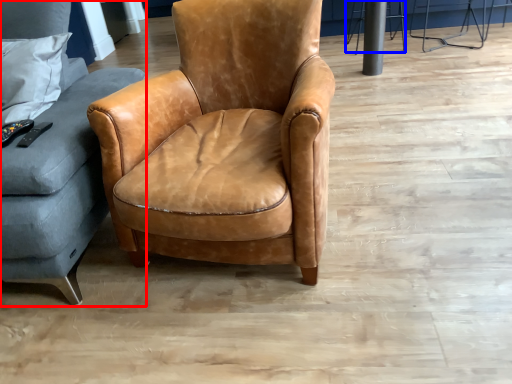
Question: Which object appears farthest to the camera in this image, studio couch (highlighted by a red box) or bar stool (highlighted by a blue box)?

Choices:
 (A) studio couch
 (B) bar stool

Answer: (B)